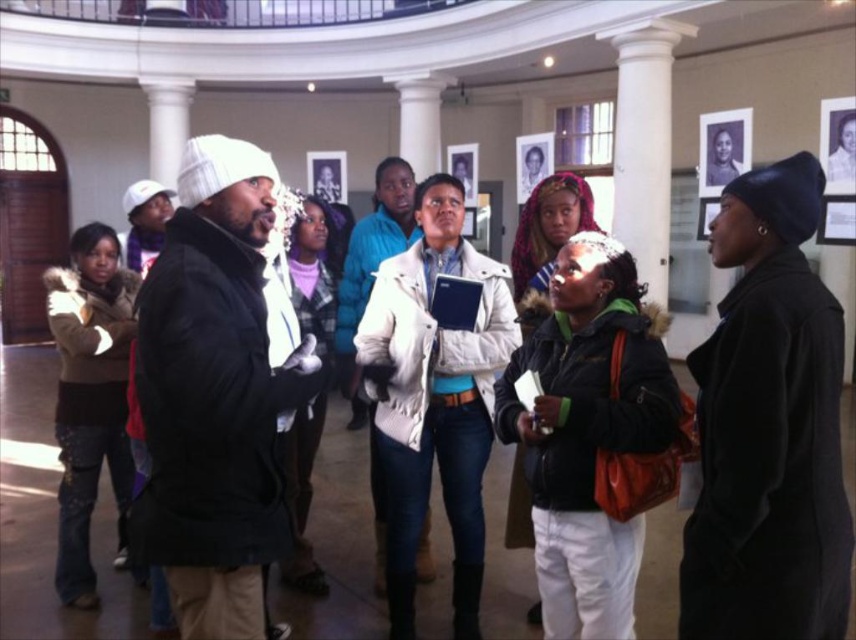
Looking at this image, you are a photographer trying to capture a clear shot of the white knit hat at center and the green fuzzy jacket at center. Which object should you focus on first if you want to ensure both are in focus, considering their sizes?

The white knit hat at center is larger in size than the green fuzzy jacket at center, so focusing on the larger white knit hat at center first would help ensure both are in focus.

You are standing in the museum and want to approach the person in the green fuzzy jacket at center. Which direction should you move to get closer to them compared to the brown fuzzy jacket at left?

The green fuzzy jacket at center is closer to the viewer than the brown fuzzy jacket at left, so you should move towards the center of the room to approach the green fuzzy jacket at center first.